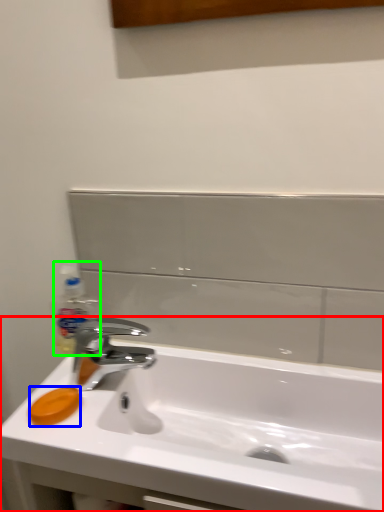
Question: Which object is the farthest from sink (highlighted by a red box)? Choose among these: soap (highlighted by a blue box) or bottle (highlighted by a green box).

Choices:
 (A) soap
 (B) bottle

Answer: (B)